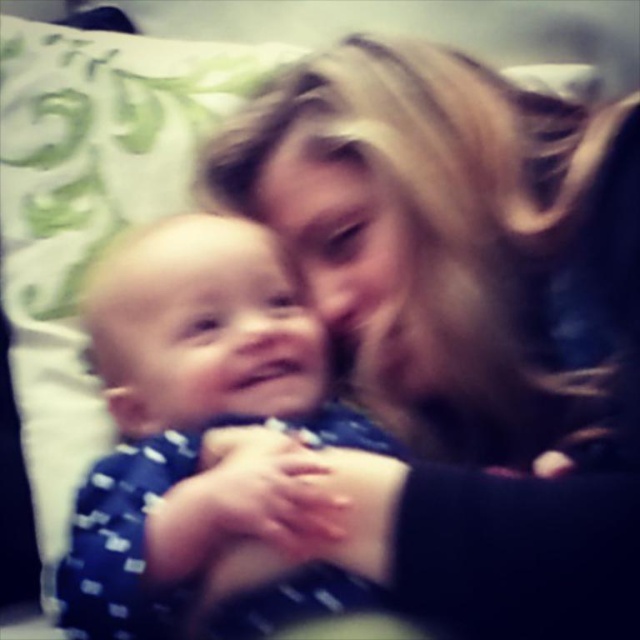
Question: Is blonde hair at upper center positioned at the back of blue dotted fabric at center?

Choices:
 (A) yes
 (B) no

Answer: (B)

Question: Which object appears closest to the camera in this image?

Choices:
 (A) blue dotted fabric at center
 (B) blonde hair at upper center

Answer: (B)

Question: Among these points, which one is nearest to the camera?

Choices:
 (A) (518, 625)
 (B) (324, 564)

Answer: (A)

Question: Is blonde hair at upper center positioned in front of blue dotted fabric at center?

Choices:
 (A) no
 (B) yes

Answer: (B)

Question: Considering the relative positions of blonde hair at upper center and blue dotted fabric at center in the image provided, where is blonde hair at upper center located with respect to blue dotted fabric at center?

Choices:
 (A) above
 (B) below

Answer: (A)